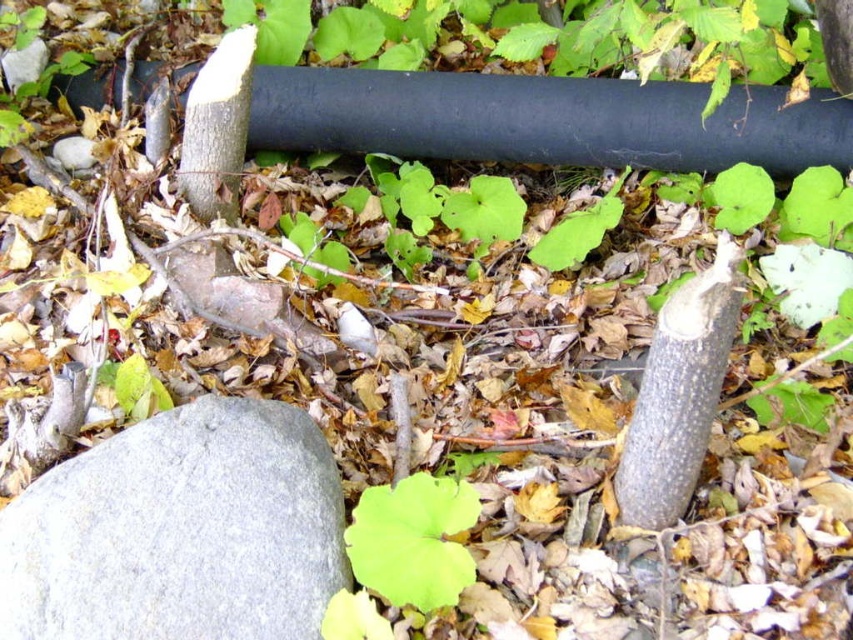
Question: Can you confirm if gray rough rock at lower left is bigger than green matte leaf at center?

Choices:
 (A) no
 (B) yes

Answer: (B)

Question: Does gray rough rock at lower left lie behind green matte leaf at center?

Choices:
 (A) yes
 (B) no

Answer: (B)

Question: Is gray rough rock at lower left further to camera compared to green matte leaf at center?

Choices:
 (A) no
 (B) yes

Answer: (A)

Question: Among these objects, which one is nearest to the camera?

Choices:
 (A) green matte leaf at center
 (B) gray rough rock at lower left

Answer: (B)